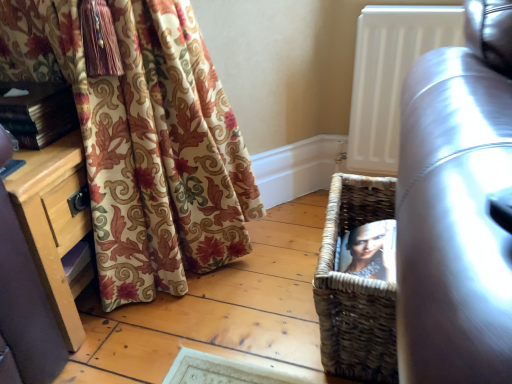
Question: From a real-world perspective, is wooden dresser at lower left below leather couch at right?

Choices:
 (A) no
 (B) yes

Answer: (B)

Question: Would you say wooden dresser at lower left is outside leather couch at right?

Choices:
 (A) no
 (B) yes

Answer: (B)

Question: From the image's perspective, is wooden dresser at lower left located above leather couch at right?

Choices:
 (A) no
 (B) yes

Answer: (B)

Question: Does wooden dresser at lower left have a lesser width compared to leather couch at right?

Choices:
 (A) no
 (B) yes

Answer: (B)

Question: Are wooden dresser at lower left and leather couch at right far apart?

Choices:
 (A) no
 (B) yes

Answer: (A)

Question: From a real-world perspective, is white matte radiator at upper right physically located above or below woven brown basket at lower right?

Choices:
 (A) below
 (B) above

Answer: (B)

Question: Does point (373, 104) appear closer or farther from the camera than point (359, 370)?

Choices:
 (A) closer
 (B) farther

Answer: (B)

Question: Visually, is white matte radiator at upper right positioned to the left or to the right of woven brown basket at lower right?

Choices:
 (A) right
 (B) left

Answer: (A)

Question: Considering their positions, is white matte radiator at upper right located in front of or behind woven brown basket at lower right?

Choices:
 (A) behind
 (B) front

Answer: (A)

Question: From the image's perspective, is hardcover book at left positioned above or below woven brown basket at lower right?

Choices:
 (A) below
 (B) above

Answer: (B)

Question: In terms of width, does hardcover book at left look wider or thinner when compared to woven brown basket at lower right?

Choices:
 (A) thin
 (B) wide

Answer: (A)

Question: Do you think hardcover book at left is within woven brown basket at lower right, or outside of it?

Choices:
 (A) inside
 (B) outside

Answer: (B)

Question: Relative to woven brown basket at lower right, is hardcover book at left in front or behind?

Choices:
 (A) behind
 (B) front

Answer: (A)

Question: Visually, is leather couch at right positioned to the left or to the right of wooden dresser at lower left?

Choices:
 (A) left
 (B) right

Answer: (B)

Question: Which is correct: leather couch at right is inside wooden dresser at lower left, or outside of it?

Choices:
 (A) inside
 (B) outside

Answer: (B)